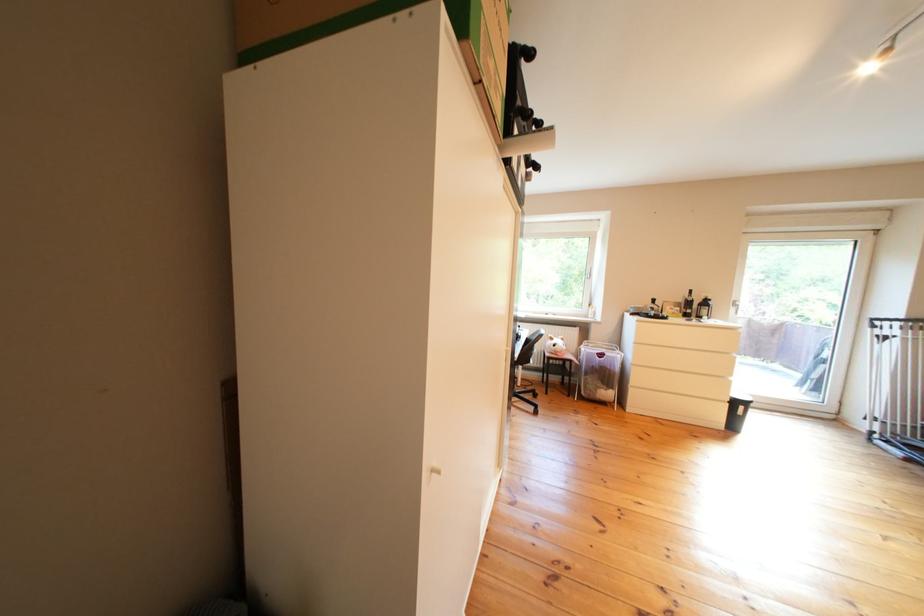
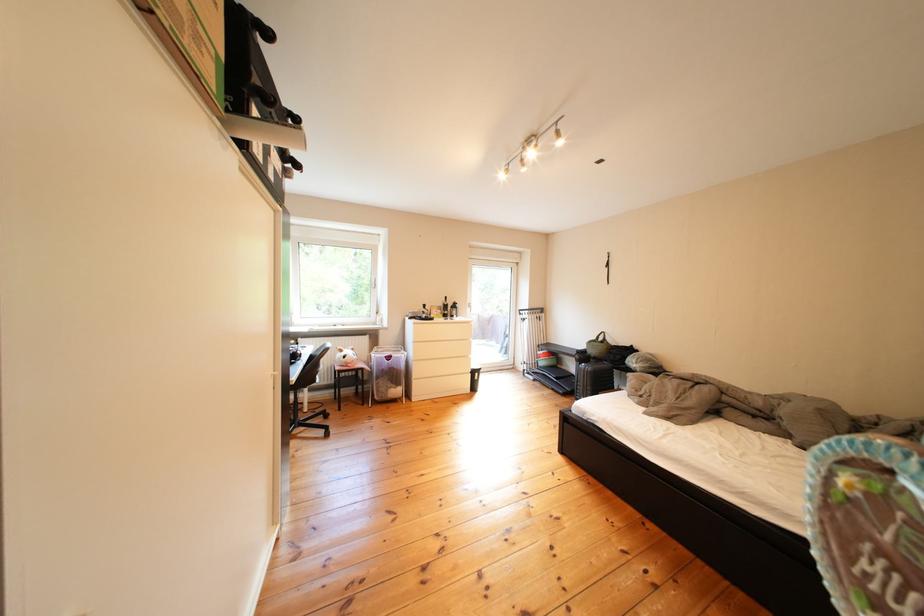
Question: The first image is from the beginning of the video and the second image is from the end. How did the camera likely rotate when shooting the video?

Choices:
 (A) Left
 (B) Right
 (C) Up
 (D) Down

Answer: (B)